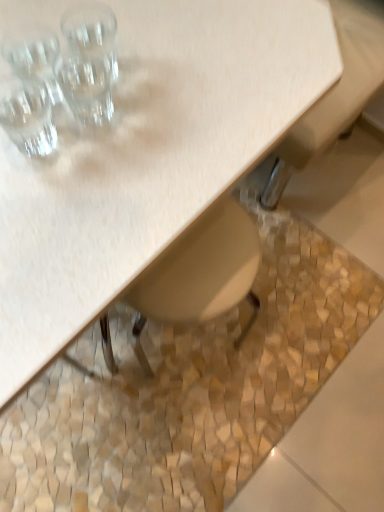
At what (x,y) coordinates should I click in order to perform the action: click on beige mosaic tile at lower center. Please return your answer as a coordinate pair (x, y). This screenshot has width=384, height=512. Looking at the image, I should click on (188, 389).

This screenshot has height=512, width=384. Describe the element at coordinates (27, 115) in the screenshot. I see `clear glass shot glass at upper left, which appears as the 1th shot glass when ordered from the bottom` at that location.

I want to click on clear glass shot glass at upper left, the 3th shot glass from the top, so click(27, 115).

Locate an element on the screen. The width and height of the screenshot is (384, 512). beige mosaic tile at lower center is located at coordinates (188, 389).

From a real-world perspective, does beige mosaic tile at lower center sit lower than clear glass shot glass at upper left, the 3th shot glass from the top?

Indeed, from a real-world perspective, beige mosaic tile at lower center is positioned beneath clear glass shot glass at upper left, the 3th shot glass from the top.

Is beige mosaic tile at lower center closer to the viewer compared to clear glass shot glass at upper left, which appears as the 1th shot glass when ordered from the bottom?

That is False.

Measure the distance between beige mosaic tile at lower center and clear glass shot glass at upper left, which appears as the 1th shot glass when ordered from the bottom.

A distance of 34.60 inches exists between beige mosaic tile at lower center and clear glass shot glass at upper left, which appears as the 1th shot glass when ordered from the bottom.

Which of these two, beige mosaic tile at lower center or clear glass shot glass at upper left, which appears as the 1th shot glass when ordered from the bottom, is bigger?

beige mosaic tile at lower center.

In the image, is transparent glass at upper left, the 2th shot glass when ordered from top to bottom, on the left side or the right side of clear glass shot glass at upper left, which appears as the 1th shot glass when ordered from the bottom?

transparent glass at upper left, the 2th shot glass when ordered from top to bottom, is positioned on clear glass shot glass at upper left, which appears as the 1th shot glass when ordered from the bottom,'s right side.

Where is `the 1st shot glass positioned above the clear glass shot glass at upper left, the 3th shot glass from the top (from the image's perspective)`? This screenshot has height=512, width=384. the 1st shot glass positioned above the clear glass shot glass at upper left, the 3th shot glass from the top (from the image's perspective) is located at coordinates (86, 87).

Can you confirm if transparent glass at upper left, positioned as the 2th shot glass in bottom-to-top order, is smaller than clear glass shot glass at upper left, the 3th shot glass from the top?

No.

Which is behind, point (113, 48) or point (85, 174)?

The point (113, 48) is farther from the camera.

From a real-world perspective, which object rests below the other?

From a 3D spatial view, matte wood table at upper left is below.

Is transparent glass at upper left, which is the 1th shot glass in top-to-bottom order, facing away from matte wood table at upper left?

No, matte wood table at upper left is not at the back of transparent glass at upper left, which is the 1th shot glass in top-to-bottom order.

This screenshot has height=512, width=384. What are the coordinates of `the 3rd shot glass behind the matte wood table at upper left` in the screenshot? It's located at (92, 32).

From the image's perspective, is beige mosaic tile at lower center over matte wood table at upper left?

Incorrect, from the image's perspective, beige mosaic tile at lower center is lower than matte wood table at upper left.

Is beige mosaic tile at lower center positioned with its back to matte wood table at upper left?

No, beige mosaic tile at lower center is not facing away from matte wood table at upper left.

Looking at this image, is beige mosaic tile at lower center placed right next to matte wood table at upper left?

No.

From the picture: Does beige mosaic tile at lower center come behind matte wood table at upper left?

Yes, beige mosaic tile at lower center is further from the camera.

Is transparent glass at upper left, which is the 1th shot glass in top-to-bottom order, thinner than beige mosaic tile at lower center?

Indeed, transparent glass at upper left, which is the 1th shot glass in top-to-bottom order, has a lesser width compared to beige mosaic tile at lower center.

Is transparent glass at upper left, which is the 1th shot glass in top-to-bottom order, placed right next to beige mosaic tile at lower center?

No, transparent glass at upper left, which is the 1th shot glass in top-to-bottom order, is not beside beige mosaic tile at lower center.

Could you tell me if transparent glass at upper left, which is the 1th shot glass in top-to-bottom order, is facing beige mosaic tile at lower center?

No.

Consider the image. Is matte wood table at upper left bigger or smaller than beige mosaic tile at lower center?

Clearly, matte wood table at upper left is larger in size than beige mosaic tile at lower center.

Is point (155, 227) in front of point (55, 420)?

Yes, it is in front of point (55, 420).

From the image's perspective, who appears lower, matte wood table at upper left or beige mosaic tile at lower center?

beige mosaic tile at lower center is shown below in the image.

Is matte wood table at upper left with beige mosaic tile at lower center?

matte wood table at upper left is not next to beige mosaic tile at lower center, and they're not touching.

Is beige mosaic tile at lower center touching transparent glass at upper left, the 2th shot glass when ordered from top to bottom?

No, beige mosaic tile at lower center is not touching transparent glass at upper left, the 2th shot glass when ordered from top to bottom.

Identify the location of granite behind the transparent glass at upper left, positioned as the 2th shot glass in bottom-to-top order. [188, 389].

In terms of height, does beige mosaic tile at lower center look taller or shorter compared to transparent glass at upper left, the 2th shot glass when ordered from top to bottom?

beige mosaic tile at lower center is shorter than transparent glass at upper left, the 2th shot glass when ordered from top to bottom.

Considering the points (126, 398) and (68, 87), which point is behind, point (126, 398) or point (68, 87)?

The point (126, 398) is behind.

Where is `granite behind the clear glass shot glass at upper left, the 3th shot glass from the top`? Image resolution: width=384 pixels, height=512 pixels. granite behind the clear glass shot glass at upper left, the 3th shot glass from the top is located at coordinates (188, 389).

I want to click on the 1st shot glass below the transparent glass at upper left, positioned as the 2th shot glass in bottom-to-top order (from a real-world perspective), so click(27, 115).

Based on their spatial positions, is transparent glass at upper left, which is the 1th shot glass in top-to-bottom order, or transparent glass at upper left, the 2th shot glass when ordered from top to bottom, closer to beige mosaic tile at lower center?

transparent glass at upper left, the 2th shot glass when ordered from top to bottom, is positioned closer to the anchor beige mosaic tile at lower center.

Considering their positions, is transparent glass at upper left, which is the 1th shot glass in top-to-bottom order, positioned further to transparent glass at upper left, positioned as the 2th shot glass in bottom-to-top order, than clear glass shot glass at upper left, which appears as the 1th shot glass when ordered from the bottom?

clear glass shot glass at upper left, which appears as the 1th shot glass when ordered from the bottom, is further to transparent glass at upper left, positioned as the 2th shot glass in bottom-to-top order.

Looking at the image, which one is located further to clear glass shot glass at upper left, the 3th shot glass from the top, beige mosaic tile at lower center or matte wood table at upper left?

The object further to clear glass shot glass at upper left, the 3th shot glass from the top, is beige mosaic tile at lower center.

Estimate the real-world distances between objects in this image. Which object is closer to clear glass shot glass at upper left, the 3th shot glass from the top, matte wood table at upper left or transparent glass at upper left, positioned as the 2th shot glass in bottom-to-top order?

transparent glass at upper left, positioned as the 2th shot glass in bottom-to-top order, is positioned closer to the anchor clear glass shot glass at upper left, the 3th shot glass from the top.

When comparing their distances from clear glass shot glass at upper left, which appears as the 1th shot glass when ordered from the bottom, does transparent glass at upper left, the third shot glass ordered from the bottom, or beige mosaic tile at lower center seem closer?

Based on the image, transparent glass at upper left, the third shot glass ordered from the bottom, appears to be nearer to clear glass shot glass at upper left, which appears as the 1th shot glass when ordered from the bottom.

When comparing their distances from transparent glass at upper left, the third shot glass ordered from the bottom, does beige mosaic tile at lower center or clear glass shot glass at upper left, the 3th shot glass from the top, seem further?

beige mosaic tile at lower center is further to transparent glass at upper left, the third shot glass ordered from the bottom.

Based on their spatial positions, is clear glass shot glass at upper left, the 3th shot glass from the top, or beige mosaic tile at lower center further from transparent glass at upper left, positioned as the 2th shot glass in bottom-to-top order?

beige mosaic tile at lower center is positioned further to the anchor transparent glass at upper left, positioned as the 2th shot glass in bottom-to-top order.

Based on their spatial positions, is beige mosaic tile at lower center or matte wood table at upper left closer to transparent glass at upper left, the third shot glass ordered from the bottom?

matte wood table at upper left.

Where is `shot glass between transparent glass at upper left, positioned as the 2th shot glass in bottom-to-top order, and beige mosaic tile at lower center, in the vertical direction`? The height and width of the screenshot is (512, 384). shot glass between transparent glass at upper left, positioned as the 2th shot glass in bottom-to-top order, and beige mosaic tile at lower center, in the vertical direction is located at coordinates (27, 115).

What are the coordinates of `shot glass that lies between transparent glass at upper left, positioned as the 2th shot glass in bottom-to-top order, and matte wood table at upper left from top to bottom` in the screenshot? It's located at (27, 115).

Image resolution: width=384 pixels, height=512 pixels. What are the coordinates of `shot glass between transparent glass at upper left, the third shot glass ordered from the bottom, and clear glass shot glass at upper left, the 3th shot glass from the top, vertically` in the screenshot? It's located at (86, 87).